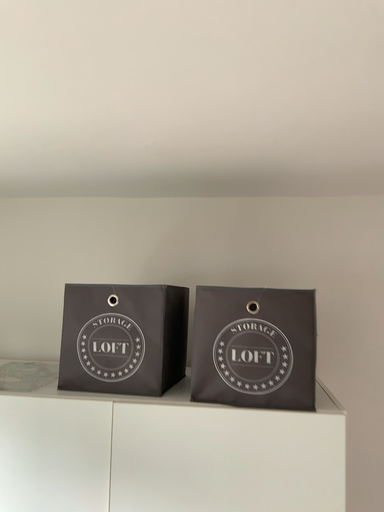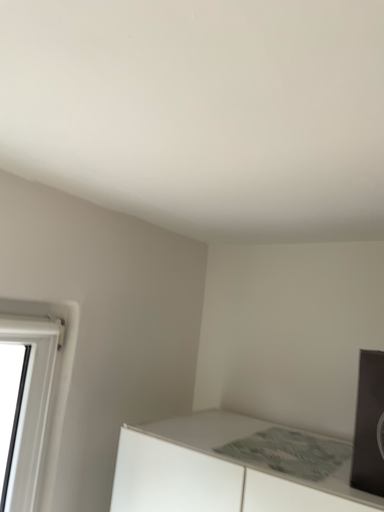
Question: Which way did the camera rotate in the video?

Choices:
 (A) rotated left
 (B) rotated right

Answer: (A)